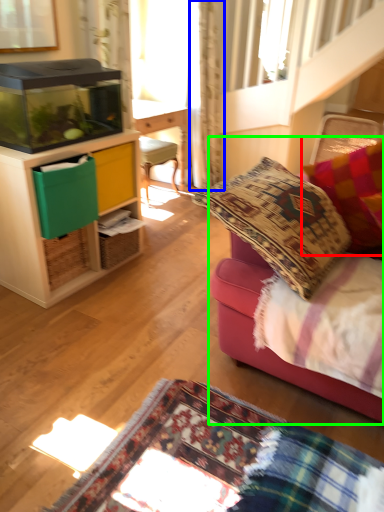
Question: Which object is positioned closest to pillow (highlighted by a red box)? Select from curtain (highlighted by a blue box) and studio couch (highlighted by a green box).

Choices:
 (A) curtain
 (B) studio couch

Answer: (B)